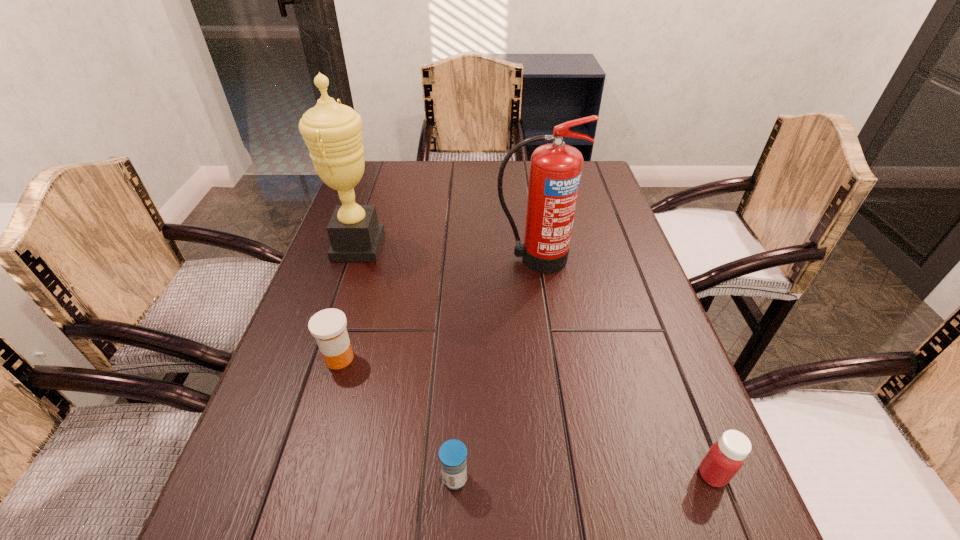
Locate an element on the screen. trophy cup is located at coordinates (333, 132).

Locate an element on the screen. fire extinguisher is located at coordinates (555, 171).

At what (x,y) coordinates should I click in order to perform the action: click on the second tallest object. Please return your answer as a coordinate pair (x, y). The width and height of the screenshot is (960, 540). Looking at the image, I should click on (555, 171).

At what (x,y) coordinates should I click in order to perform the action: click on the third farthest object. Please return your answer as a coordinate pair (x, y). The height and width of the screenshot is (540, 960). Looking at the image, I should click on (328, 326).

This screenshot has width=960, height=540. What are the coordinates of `the leftmost medicine` in the screenshot? It's located at (328, 326).

Where is `the rightmost medicine`? the rightmost medicine is located at coordinates (724, 459).

Identify the location of the shortest object. The image size is (960, 540). (452, 453).

Image resolution: width=960 pixels, height=540 pixels. Identify the location of the second medicine from left to right. (452, 453).

Locate an element on the screen. The image size is (960, 540). vacant area situated 0.170m at the front of the trophy cup with handles is located at coordinates (445, 246).

Identify the location of vacant space located 0.200m on the surface of the second object from right to left. The image size is (960, 540). (545, 334).